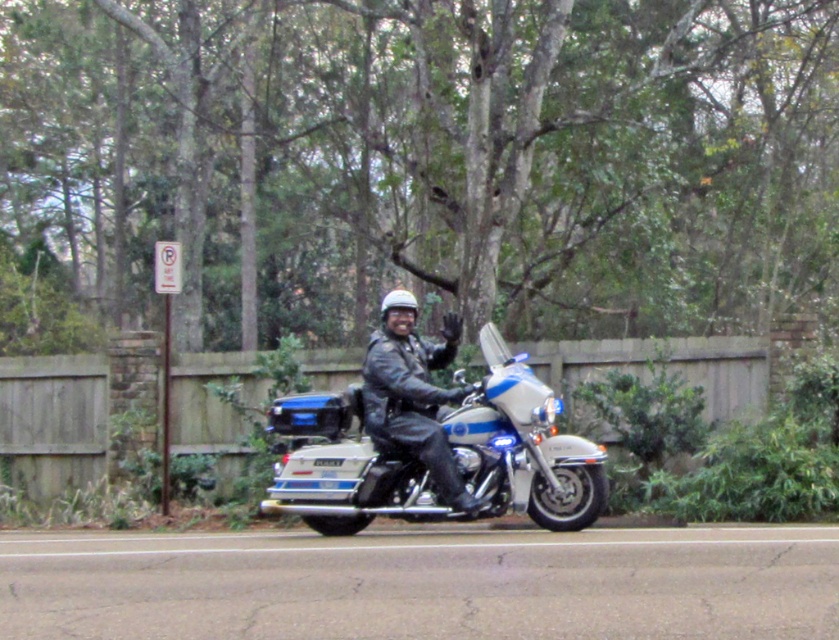
You are standing at the camera position and want to know how far the point at coordinates point (481, 387) is from you. Can you determine the distance?

The point at coordinates point (481, 387) is 10.29 meters away from the camera.

You are a drone operator trying to capture a photo of the police motorcycle from above. The drone must stay within a 100m radius of the green leafy tree at center. Given that the motorcycle is positioned 50 meters north of the tree, will the drone be able to capture the motorcycle within the allowed radius?

The green leafy tree at center is located at point (425, 160). The motorcycle is 50 meters north of it. Since the drone must stay within a 100m radius of the tree, the 50m distance is within the 100m limit. Therefore, the drone can capture the motorcycle within the allowed radius.

You are a pedestrian standing on the sidewalk and see the green leafy tree at center and the shiny chrome motorcycle at center. Which object is closer to you?

The green leafy tree at center is closer to you because the shiny chrome motorcycle at center is behind it.